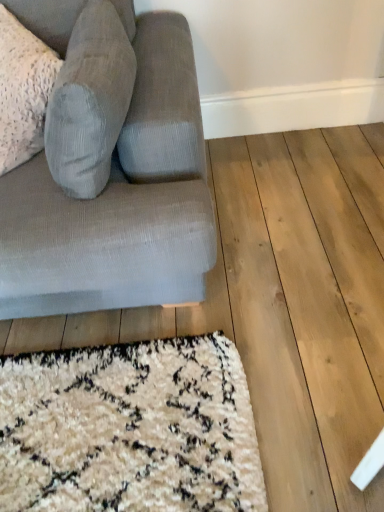
At what (x,y) coordinates should I click in order to perform the action: click on textured corduroy pillow at left. Please return your answer as a coordinate pair (x, y). Image resolution: width=384 pixels, height=512 pixels. Looking at the image, I should click on (91, 98).

Describe the element at coordinates (91, 98) in the screenshot. I see `textured corduroy pillow at left` at that location.

Measure the distance between textured corduroy pillow at left and camera.

textured corduroy pillow at left is 91.82 centimeters away from camera.

Measure the distance between point (53, 281) and camera.

Point (53, 281) is 3.56 feet from camera.

Describe the element at coordinates (112, 176) in the screenshot. This screenshot has height=512, width=384. I see `textured gray couch at left` at that location.

This screenshot has width=384, height=512. I want to click on textured gray couch at left, so click(x=112, y=176).

Locate an element on the screen. The image size is (384, 512). textured corduroy pillow at left is located at coordinates (91, 98).

Between textured corduroy pillow at left and textured gray couch at left, which one appears on the right side from the viewer's perspective?

textured gray couch at left.

Does textured corduroy pillow at left come behind textured gray couch at left?

Yes, textured corduroy pillow at left is behind textured gray couch at left.

Which point is more forward, (129,51) or (56,229)?

Point (56,229)

From the image's perspective, is textured corduroy pillow at left above or below textured gray couch at left?

From the image's perspective, textured corduroy pillow at left appears above textured gray couch at left.

From a real-world perspective, which object stands above the other?

textured corduroy pillow at left.

Which of these two, textured corduroy pillow at left or textured gray couch at left, is wider?

textured gray couch at left.

In terms of height, does textured corduroy pillow at left look taller or shorter compared to textured gray couch at left?

Considering their sizes, textured corduroy pillow at left has less height than textured gray couch at left.

Between textured corduroy pillow at left and textured gray couch at left, which one has larger size?

With larger size is textured gray couch at left.

Looking at this image, is textured corduroy pillow at left inside or outside of textured gray couch at left?

textured corduroy pillow at left lies within the bounds of textured gray couch at left.

Is textured corduroy pillow at left far from textured gray couch at left?

No, textured corduroy pillow at left is not far from textured gray couch at left.

Is textured corduroy pillow at left aimed at textured gray couch at left?

Yes, textured corduroy pillow at left faces towards textured gray couch at left.

Based on the photo, how many degrees apart are the facing directions of textured corduroy pillow at left and textured gray couch at left?

The angle between the facing direction of textured corduroy pillow at left and the facing direction of textured gray couch at left is 53.2 degrees.

The width and height of the screenshot is (384, 512). There is a textured gray couch at left. Find the location of `gray above it (from a real-world perspective)`. gray above it (from a real-world perspective) is located at coordinates (91, 98).

Does textured gray couch at left appear on the right side of textured corduroy pillow at left?

Indeed, textured gray couch at left is positioned on the right side of textured corduroy pillow at left.

Is textured gray couch at left positioned behind textured corduroy pillow at left?

No.

Is point (172, 121) positioned after point (91, 97)?

Yes, it is.

From the image's perspective, which one is positioned higher, textured gray couch at left or textured corduroy pillow at left?

textured corduroy pillow at left, from the image's perspective.

From a real-world perspective, relative to textured corduroy pillow at left, is textured gray couch at left vertically above or below?

In terms of real-world spatial position, textured gray couch at left is below textured corduroy pillow at left.

Between textured gray couch at left and textured corduroy pillow at left, which one has smaller width?

textured corduroy pillow at left is thinner.

Looking at this image, can you confirm if textured gray couch at left is shorter than textured corduroy pillow at left?

Incorrect, the height of textured gray couch at left does not fall short of that of textured corduroy pillow at left.

Is textured gray couch at left bigger or smaller than textured corduroy pillow at left?

Clearly, textured gray couch at left is larger in size than textured corduroy pillow at left.

Would you say textured gray couch at left is inside or outside textured corduroy pillow at left?

textured gray couch at left is not inside textured corduroy pillow at left, it's outside.

Is textured gray couch at left positioned far away from textured corduroy pillow at left?

That's not correct — textured gray couch at left is a little close to textured corduroy pillow at left.

Is textured gray couch at left turned away from textured corduroy pillow at left?

Yes, textured gray couch at left's orientation is away from textured corduroy pillow at left.

How different are the orientations of textured gray couch at left and textured corduroy pillow at left in degrees?

textured gray couch at left and textured corduroy pillow at left are facing 53.2 degrees away from each other.

Find the location of a particular element. This screenshot has width=384, height=512. studio couch that is in front of the textured corduroy pillow at left is located at coordinates (112, 176).

I want to click on studio couch below the textured corduroy pillow at left (from a real-world perspective), so click(112, 176).

Where is `studio couch in front of the textured corduroy pillow at left`? studio couch in front of the textured corduroy pillow at left is located at coordinates (112, 176).